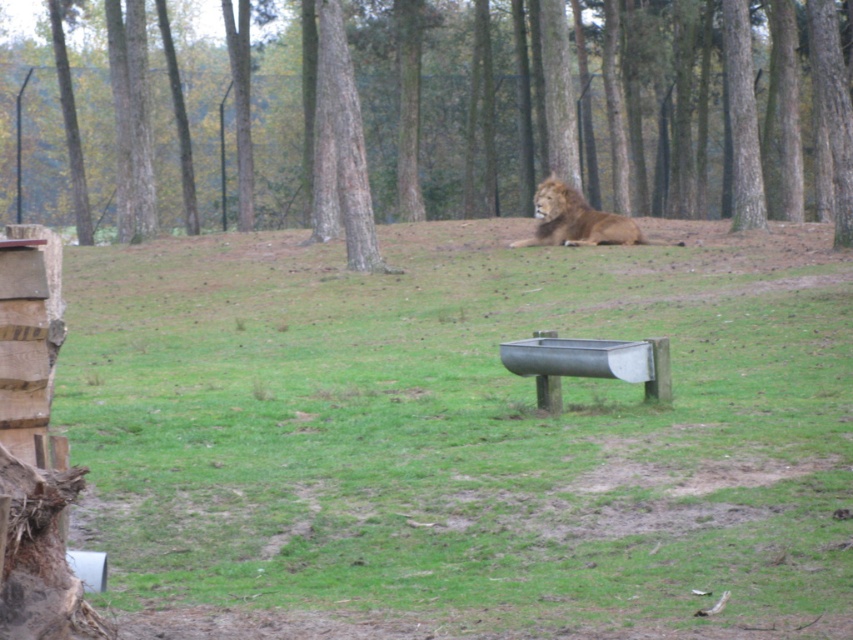
Question: Which of the following is the farthest from the observer?

Choices:
 (A) brown wood tree at center
 (B) golden fur lion at center

Answer: (B)

Question: Which point appears farthest from the camera in this image?

Choices:
 (A) [345, 412]
 (B) [103, 13]

Answer: (B)

Question: Does green grassy at center appear under brown wood tree at center?

Choices:
 (A) no
 (B) yes

Answer: (B)

Question: Observing the image, what is the correct spatial positioning of brown wood tree at center in reference to golden fur lion at center?

Choices:
 (A) above
 (B) below

Answer: (A)

Question: Estimate the real-world distances between objects in this image. Which object is closer to the green grassy at center?

Choices:
 (A) golden fur lion at center
 (B) brown wood tree at center

Answer: (A)

Question: Can you confirm if green grassy at center is positioned above brown wood tree at center?

Choices:
 (A) yes
 (B) no

Answer: (B)